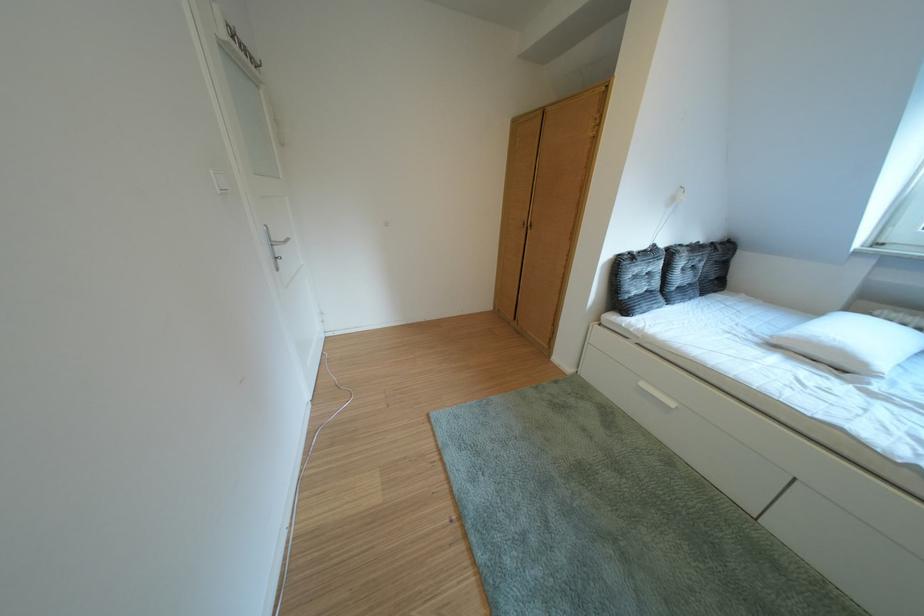
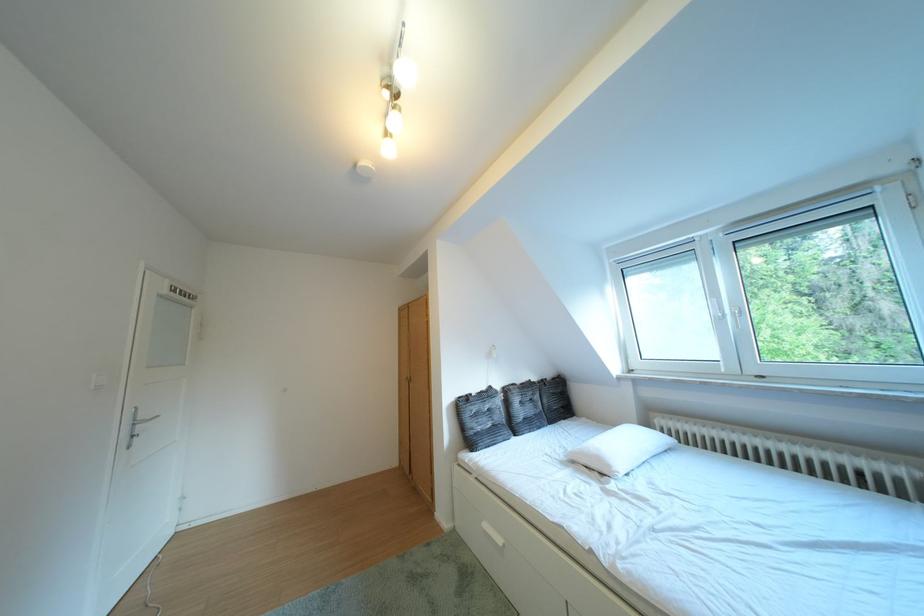
In the second image, find the point that corresponds to point (640, 301) in the first image.

(484, 438)